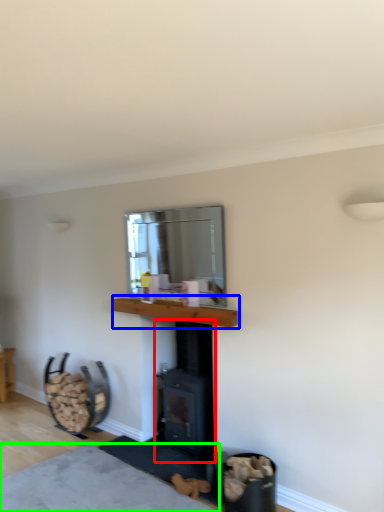
Question: Considering the real-world distances, which object is farthest from wood burning stove (highlighted by a red box)? counter top (highlighted by a blue box) or plain (highlighted by a green box)?

Choices:
 (A) counter top
 (B) plain

Answer: (B)